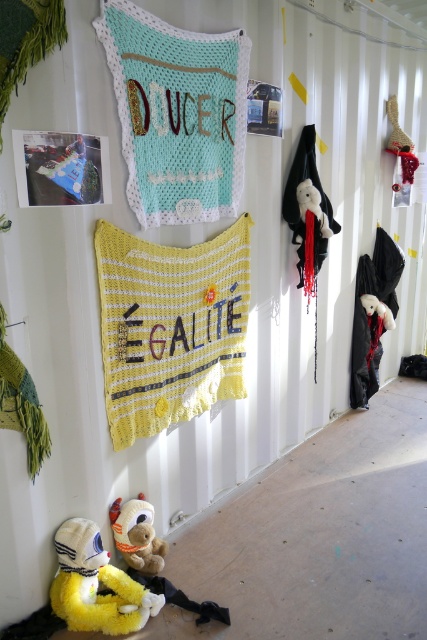
You are organizing a childrens party and need to decide which item to use as a backdrop. The yellow crocheted blanket at center and the yellow plush toy at lower left are available. Which one is larger and more suitable for a backdrop?

The yellow crocheted blanket at center is bigger than the yellow plush toy at lower left, making it more suitable for a backdrop.

You are organizing a small exhibition in a gallery and have these two items displayed on a shelf. The crochet fabric pillow at upper center and the brown plush teddy bear at lower left. Since you need to ensure proper spacing between them, can you determine which item requires more vertical space due to its height?

The crochet fabric pillow at upper center requires more vertical space because it has a greater height compared to the brown plush teddy bear at lower left.